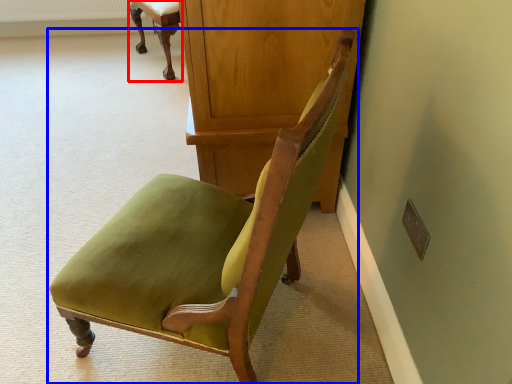
Question: Which object is closer to the camera taking this photo, chair (highlighted by a red box) or chair (highlighted by a blue box)?

Choices:
 (A) chair
 (B) chair

Answer: (B)